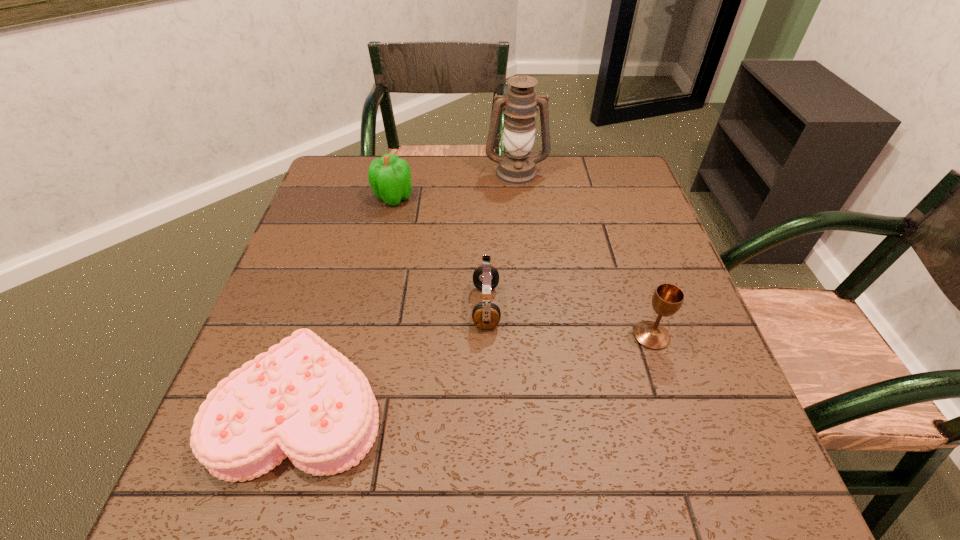
The image size is (960, 540). Find the location of `the tallest object`. the tallest object is located at coordinates (516, 167).

Locate an element on the screen. the farthest object is located at coordinates (516, 167).

Find the location of `the second farthest object`. the second farthest object is located at coordinates (389, 176).

Image resolution: width=960 pixels, height=540 pixels. In order to click on chalice in this screenshot , I will do `click(667, 299)`.

Locate an element on the screen. The width and height of the screenshot is (960, 540). headset is located at coordinates (486, 315).

Image resolution: width=960 pixels, height=540 pixels. I want to click on cake, so click(303, 399).

Where is `vacant area located on the front of the oil lamp`? vacant area located on the front of the oil lamp is located at coordinates click(518, 195).

Where is `free location located on the left of the fourth nearest object`? The height and width of the screenshot is (540, 960). free location located on the left of the fourth nearest object is located at coordinates (348, 198).

At what (x,y) coordinates should I click in order to perform the action: click on vacant space located 0.200m on the left of the rightmost object. Please return your answer as a coordinate pair (x, y). The image size is (960, 540). Looking at the image, I should click on (536, 336).

Where is `free location located on the ear cups of the headset`? The height and width of the screenshot is (540, 960). free location located on the ear cups of the headset is located at coordinates (375, 307).